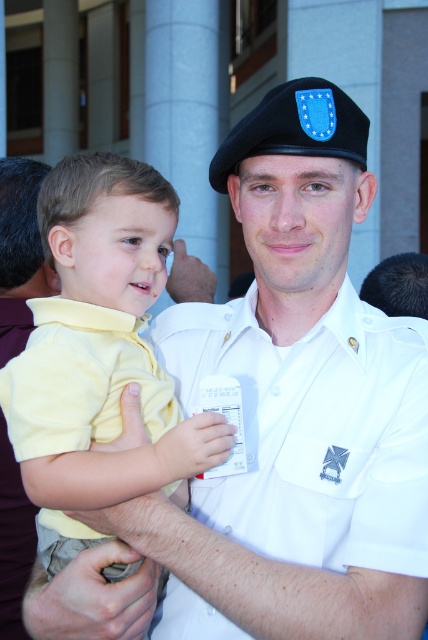
You are a tailor measuring shirts for a customer. You have two shirts in front of you, the yellow matte shirt at center and the yellow cotton shirt at center. The customer wants to know which one is closer to the center of the image. Can you tell them?

The yellow matte shirt at center is closer to the center of the image than the yellow cotton shirt at center because it is only 2.74 inches away from it.

You are standing at the origin point in the image. The yellow matte shirt at center is represented by point (107, 433). Which direction should you move to reach the yellow matte shirt at center?

The yellow matte shirt at center is located at point (107, 433), so you should move towards the coordinates (107, 433) to reach it.

Based on the scene description, which object is shorter between the white cotton shirt at center and the yellow matte shirt at center?

The white cotton shirt at center is shorter than the yellow matte shirt at center.